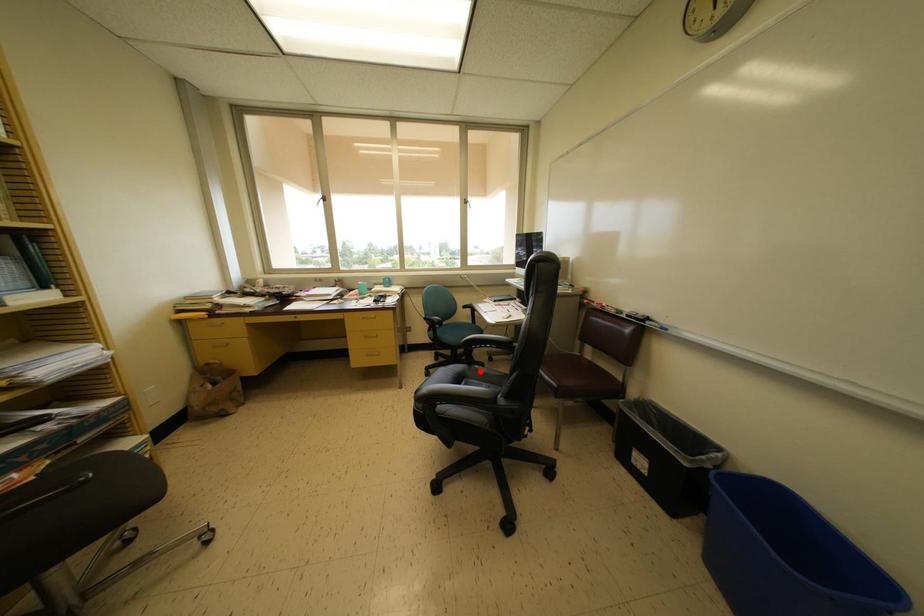
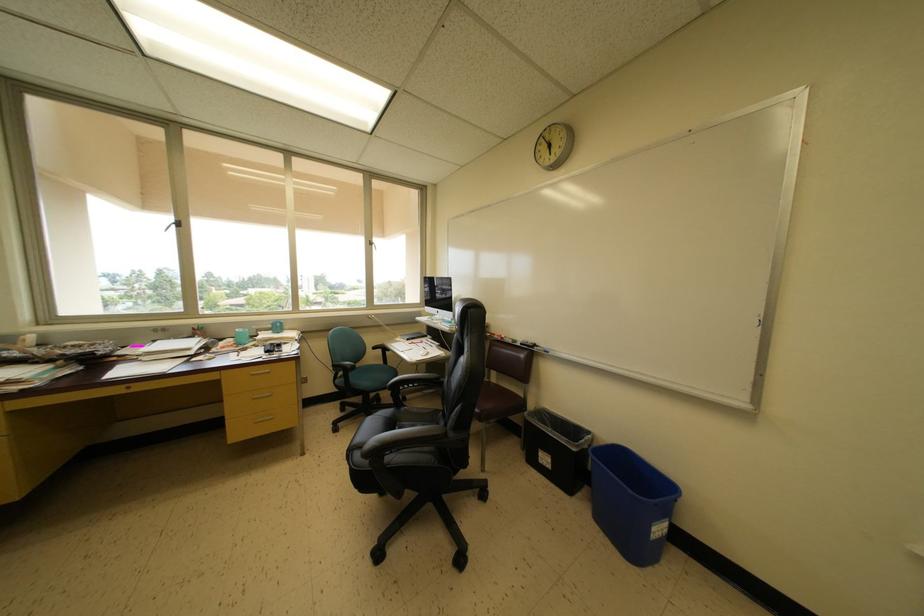
Locate, in the second image, the point that corresponds to the highlighted location in the first image.

(408, 413)